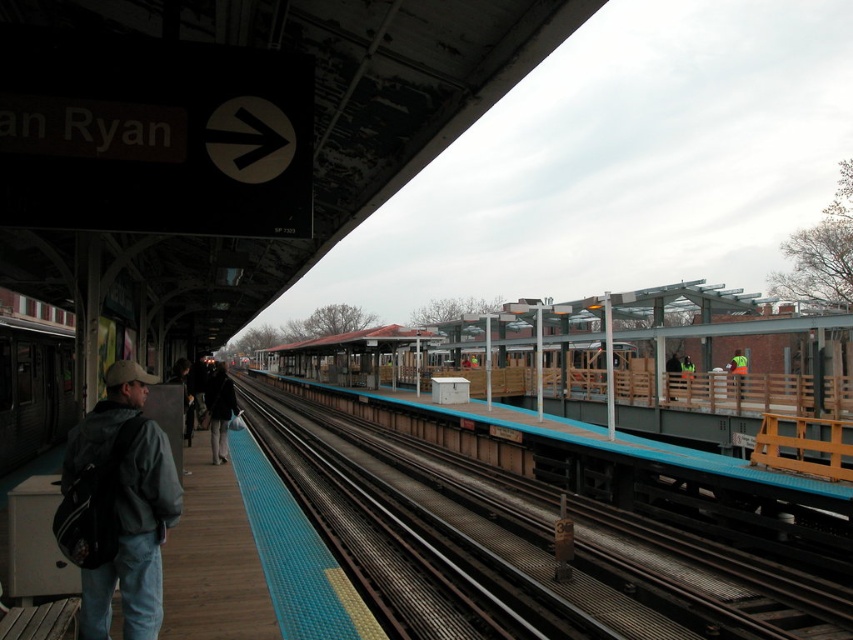
You are standing at the train station platform and want to locate the smooth concrete track at center. According to the coordinates provided, where exactly should you look to find it?

The smooth concrete track at center is located at the coordinates point (706,579).

You are standing on the platform and want to walk from the dark gray jacket at center to the smooth concrete track at center. How many steps would you need to take if each step covers approximately 2.2 feet?

The distance between the smooth concrete track at center and dark gray jacket at center is 24.40 feet. Dividing 24.40 by 2.2 gives approximately 11.09 steps. Since you can only take whole steps, you would need to take 11 steps to cover the distance.

You are standing on the train station platform and want to move from the sign labeled Ryan to the blue tactile paving strip. Which point, point (593, 560) or point (65, 547), is closer to the blue tactile paving strip?

Point (65, 547) is closer to the blue tactile paving strip because it is in front of point (593, 560).